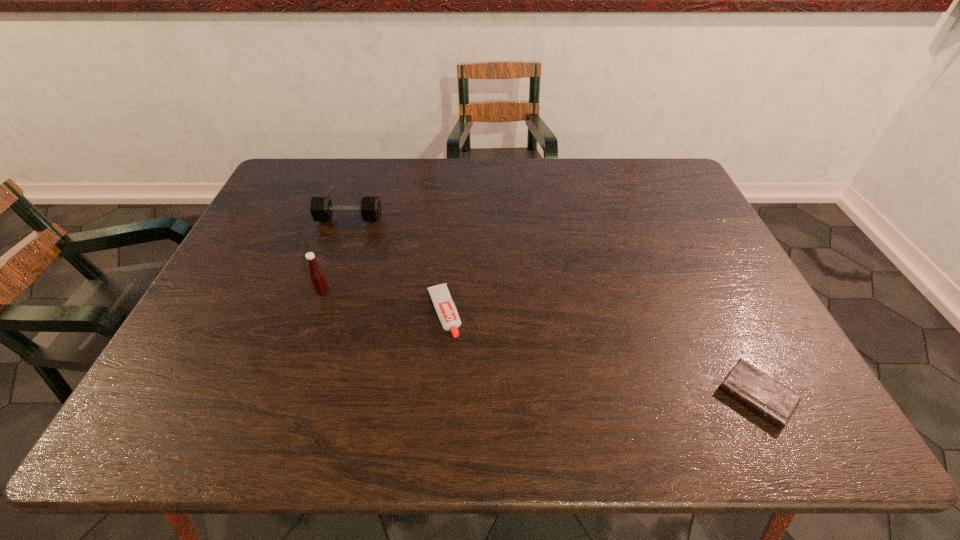
I want to click on free spot between the farthest object and the third object from left to right, so click(396, 266).

The image size is (960, 540). Find the location of `blank region between the third shortest object and the tallest object`. blank region between the third shortest object and the tallest object is located at coordinates (336, 255).

Image resolution: width=960 pixels, height=540 pixels. Find the location of `free space between the tallest object and the third shortest object`. free space between the tallest object and the third shortest object is located at coordinates (336, 255).

Image resolution: width=960 pixels, height=540 pixels. In order to click on free space between the farthest object and the third tallest object in this screenshot , I will do `click(396, 266)`.

This screenshot has width=960, height=540. I want to click on free space between the dumbbell and the toothpaste, so click(x=396, y=266).

Identify the location of empty location between the nearest object and the toothpaste. (600, 355).

At what (x,y) coordinates should I click in order to perform the action: click on unoccupied position between the nearest object and the third tallest object. Please return your answer as a coordinate pair (x, y). Looking at the image, I should click on (600, 355).

Where is `empty space that is in between the tallest object and the rightmost object`? This screenshot has height=540, width=960. empty space that is in between the tallest object and the rightmost object is located at coordinates (540, 343).

The height and width of the screenshot is (540, 960). Identify the location of free space between the nearest object and the Tabasco sauce. (540, 343).

Choose which object is the nearest neighbor to the second tallest object. Please provide its 2D coordinates. Your answer should be formatted as a tuple, i.e. [(x, y)], where the tuple contains the x and y coordinates of a point satisfying the conditions above.

[(317, 277)]